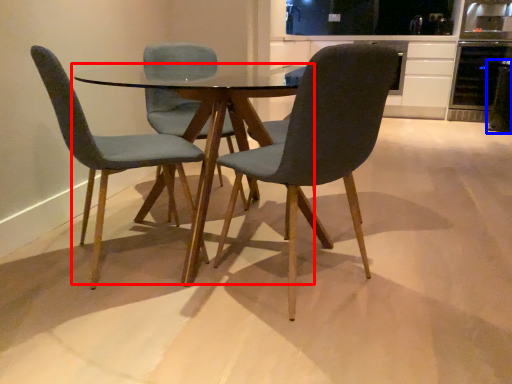
Question: Which object appears closest to the camera in this image, coffee table (highlighted by a red box) or appliance (highlighted by a blue box)?

Choices:
 (A) coffee table
 (B) appliance

Answer: (A)